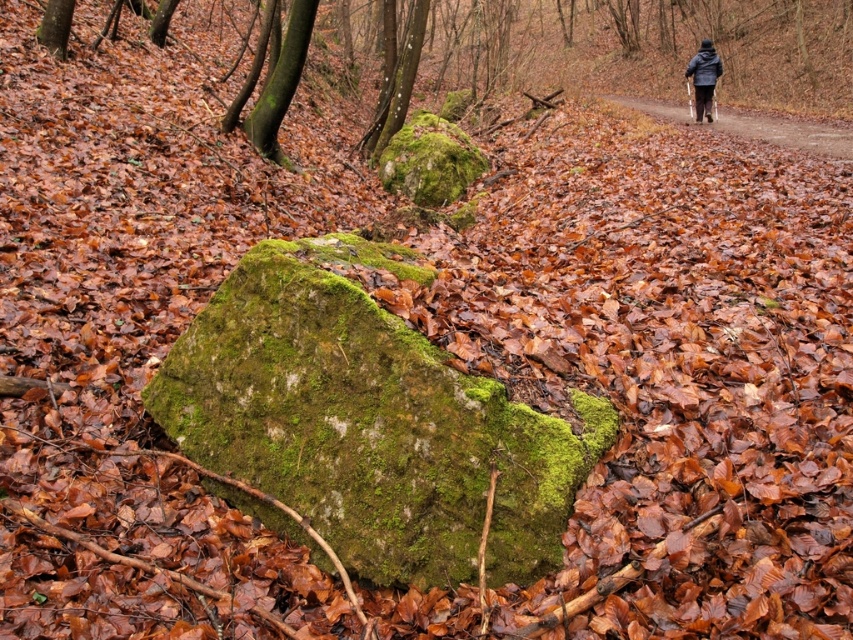
Between brown dirt path at center and dark blue jacket at upper right, which one appears on the left side from the viewer's perspective?

dark blue jacket at upper right is more to the left.

Is brown dirt path at center to the left of dark blue jacket at upper right from the viewer's perspective?

Incorrect, brown dirt path at center is not on the left side of dark blue jacket at upper right.

Which is in front, point (815, 147) or point (712, 49)?

Positioned in front is point (815, 147).

You are a GUI agent. You are given a task and a screenshot of the screen. Output one action in this format:
    pyautogui.click(x=<x>, y=<y>)
    Task: Click on the brown dirt path at center
    This screenshot has height=640, width=853.
    Given the screenshot: What is the action you would take?
    pyautogui.click(x=785, y=131)

Can you confirm if green mossy rock at center is positioned above brown dirt path at center?

Actually, green mossy rock at center is below brown dirt path at center.

Based on the photo, who is higher up, green mossy rock at center or brown dirt path at center?

Positioned higher is brown dirt path at center.

I want to click on green mossy rock at center, so click(x=370, y=420).

Can you confirm if green mossy rock at center is positioned above dark blue jacket at upper right?

No, green mossy rock at center is not above dark blue jacket at upper right.

Does point (341, 237) lie behind point (701, 97)?

That is False.

Is point (402, 269) behind point (698, 99)?

No, (402, 269) is in front of (698, 99).

The width and height of the screenshot is (853, 640). In order to click on green mossy rock at center in this screenshot , I will do `click(370, 420)`.